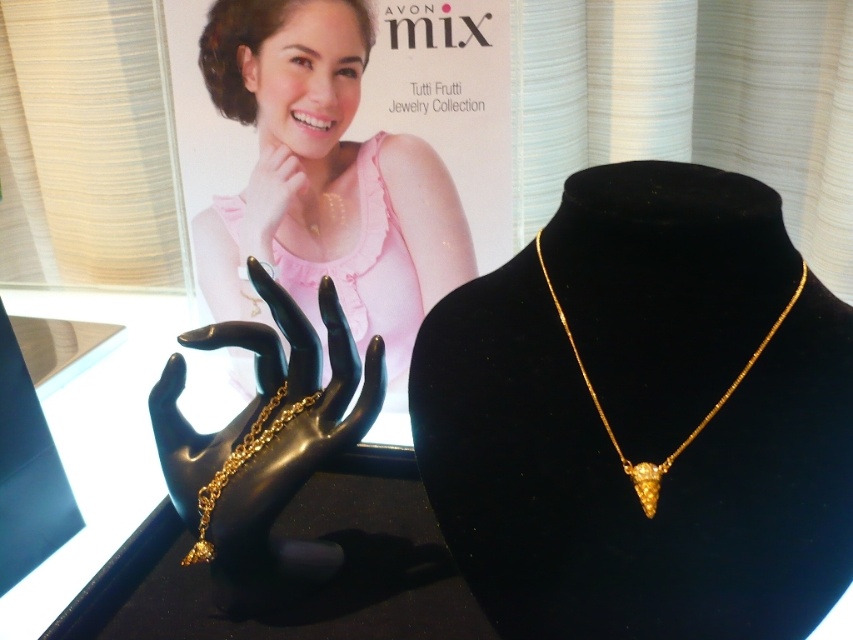
Does matte gold necklace at center appear on the right side of gold chain at center?

Yes, matte gold necklace at center is to the right of gold chain at center.

Which is in front, point (236, 49) or point (212, 545)?

Point (212, 545) is in front.

Who is more distant from viewer, (247,3) or (300,404)?

Point (247,3)

Find the location of a particular element. matte gold necklace at center is located at coordinates (323, 180).

Is matte gold necklace at center behind gold metallic ring at upper center?

No, matte gold necklace at center is closer to the viewer.

Who is more forward, (318, 228) or (300, 168)?

Point (300, 168) is more forward.

At what (x,y) coordinates should I click in order to perform the action: click on matte gold necklace at center. Please return your answer as a coordinate pair (x, y). The image size is (853, 640). Looking at the image, I should click on (323, 180).

Find the location of `matte gold necklace at center`. matte gold necklace at center is located at coordinates (323, 180).

What do you see at coordinates (323, 180) in the screenshot? I see `matte gold necklace at center` at bounding box center [323, 180].

Which is below, matte gold necklace at center or gold metallic bracelet at center?

gold metallic bracelet at center is below.

Does point (463, 262) lie behind point (248, 518)?

Yes, it is behind point (248, 518).

Locate an element on the screen. matte gold necklace at center is located at coordinates (323, 180).